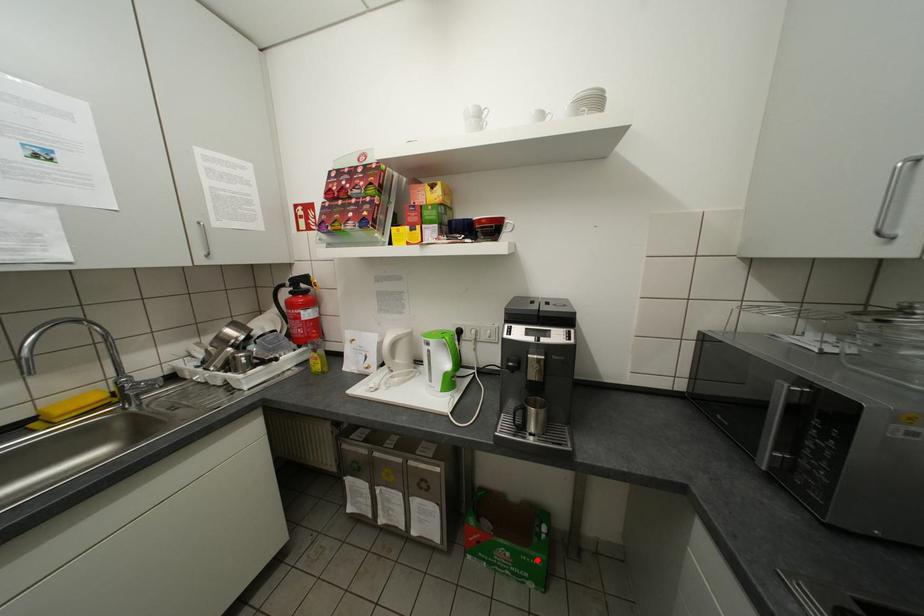
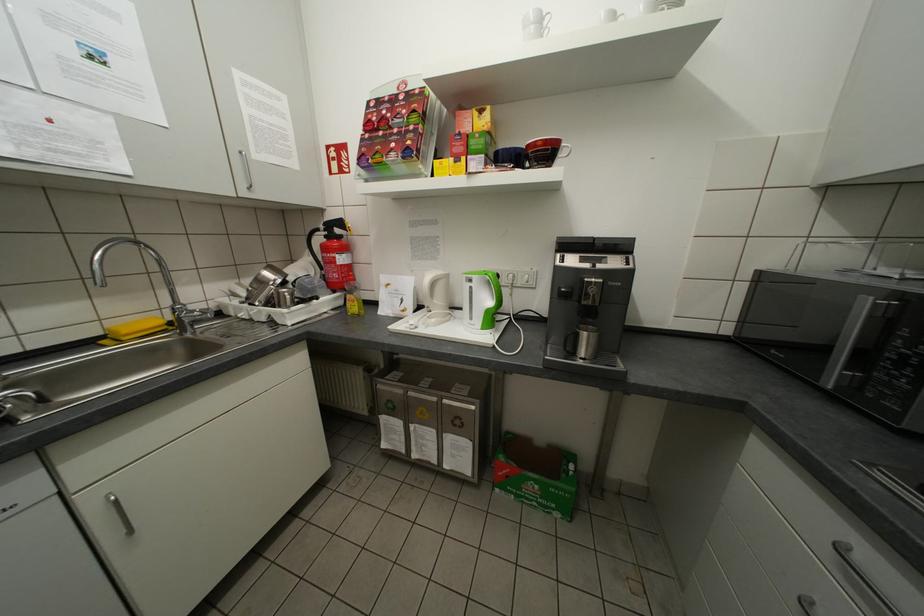
Locate, in the second image, the point that corresponds to the highlighted location in the first image.

(565, 492)